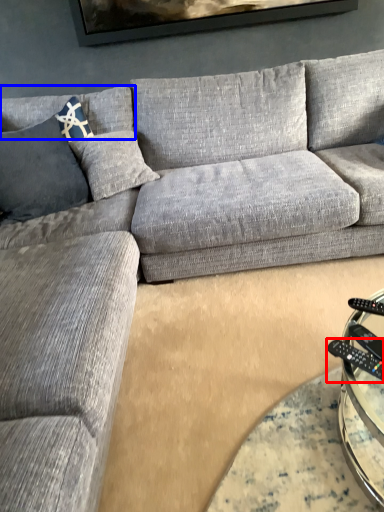
Question: Which point is closer to the camera, control (highlighted by a red box) or pillow (highlighted by a blue box)?

Choices:
 (A) control
 (B) pillow

Answer: (A)